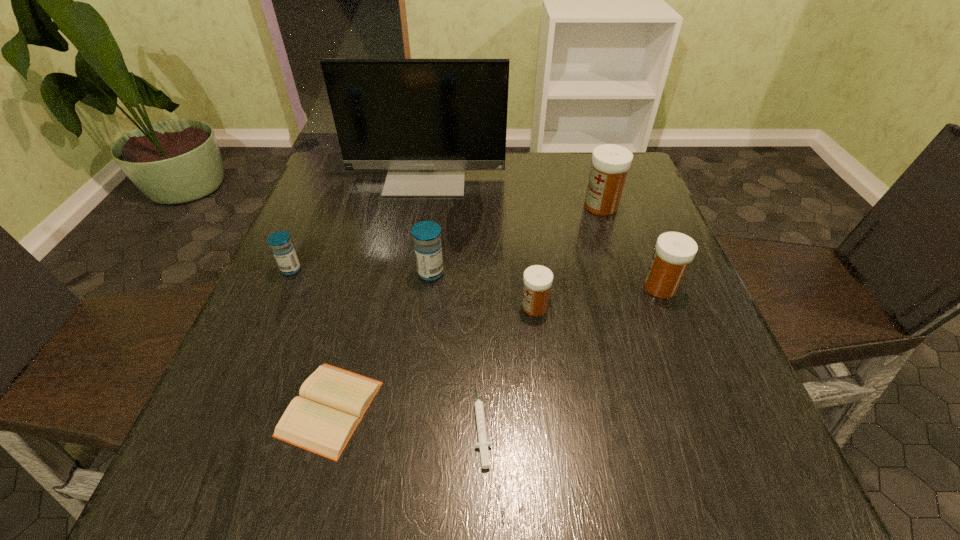
What are the coordinates of `free spot located on the left of the syringe` in the screenshot? It's located at (437, 424).

At what (x,y) coordinates should I click in order to perform the action: click on computer monitor that is at the far edge. Please return your answer as a coordinate pair (x, y). The width and height of the screenshot is (960, 540). Looking at the image, I should click on (426, 121).

Identify the location of medicine that is at the far edge. The width and height of the screenshot is (960, 540). (610, 163).

The width and height of the screenshot is (960, 540). Find the location of `diary present at the near edge`. diary present at the near edge is located at coordinates (332, 402).

At what (x,y) coordinates should I click in order to perform the action: click on syringe present at the near edge. Please return your answer as a coordinate pair (x, y). Image resolution: width=960 pixels, height=540 pixels. Looking at the image, I should click on (483, 444).

This screenshot has height=540, width=960. In order to click on computer monitor that is at the left edge in this screenshot , I will do `click(426, 121)`.

The image size is (960, 540). Identify the location of medicine located at the left edge. (280, 242).

This screenshot has height=540, width=960. In order to click on diary at the left edge in this screenshot , I will do `click(332, 402)`.

Where is `object that is at the far left corner`? The height and width of the screenshot is (540, 960). object that is at the far left corner is located at coordinates (426, 121).

This screenshot has height=540, width=960. I want to click on object that is at the near left corner, so click(332, 402).